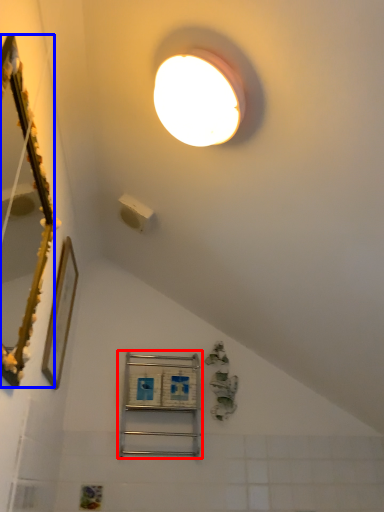
Question: Which object appears farthest to the camera in this image, shelf (highlighted by a red box) or mirror (highlighted by a blue box)?

Choices:
 (A) shelf
 (B) mirror

Answer: (A)